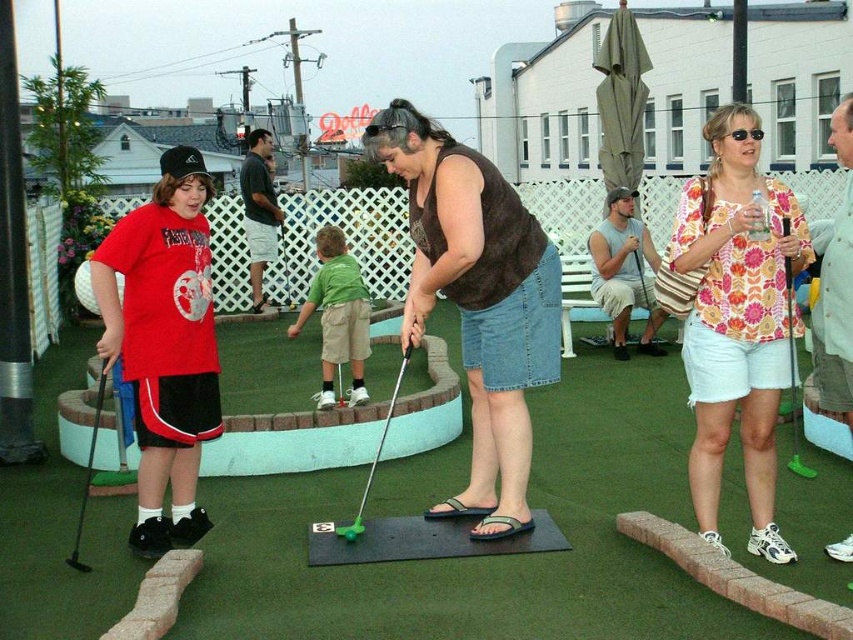
Question: Which object is closer to the camera taking this photo?

Choices:
 (A) green plastic golf club at lower left
 (B) green artificial turf at center
 (C) gray sleeveless shirt at center
 (D) matte red t-shirt at left

Answer: (B)

Question: Where is floral cotton shirt at upper right located in relation to gray sleeveless shirt at center in the image?

Choices:
 (A) below
 (B) above

Answer: (A)

Question: Which point appears farthest from the camera in this image?

Choices:
 (A) pyautogui.click(x=296, y=326)
 (B) pyautogui.click(x=273, y=211)
 (C) pyautogui.click(x=84, y=509)
 (D) pyautogui.click(x=138, y=244)

Answer: (B)

Question: Among these points, which one is nearest to the camera?

Choices:
 (A) (157, 547)
 (B) (791, 349)
 (C) (660, 312)
 (D) (834, 401)

Answer: (B)

Question: Is brown fuzzy vest at center smaller than green plastic golf club at center?

Choices:
 (A) no
 (B) yes

Answer: (A)

Question: Can you confirm if brown fuzzy vest at center is thinner than gray sleeveless shirt at center?

Choices:
 (A) yes
 (B) no

Answer: (B)